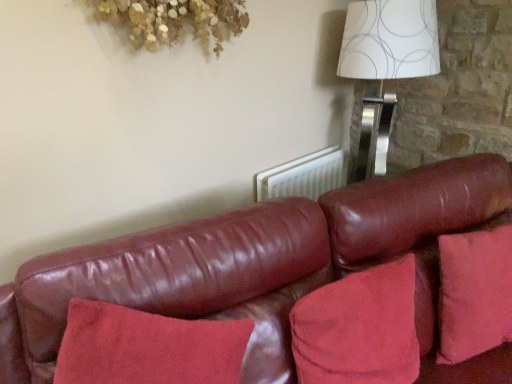
Question: Is point (376, 3) closer or farther from the camera than point (218, 238)?

Choices:
 (A) closer
 (B) farther

Answer: (B)

Question: From the image's perspective, is white paper with silver circles at upper right positioned above or below leather couch at center?

Choices:
 (A) below
 (B) above

Answer: (B)

Question: Which is nearer to the suede-like red pillow at lower right?

Choices:
 (A) leather couch at center
 (B) white paper with silver circles at upper right

Answer: (A)

Question: Which of these objects is positioned farthest from the white paper with silver circles at upper right?

Choices:
 (A) suede-like red pillow at lower right
 (B) leather couch at center

Answer: (A)